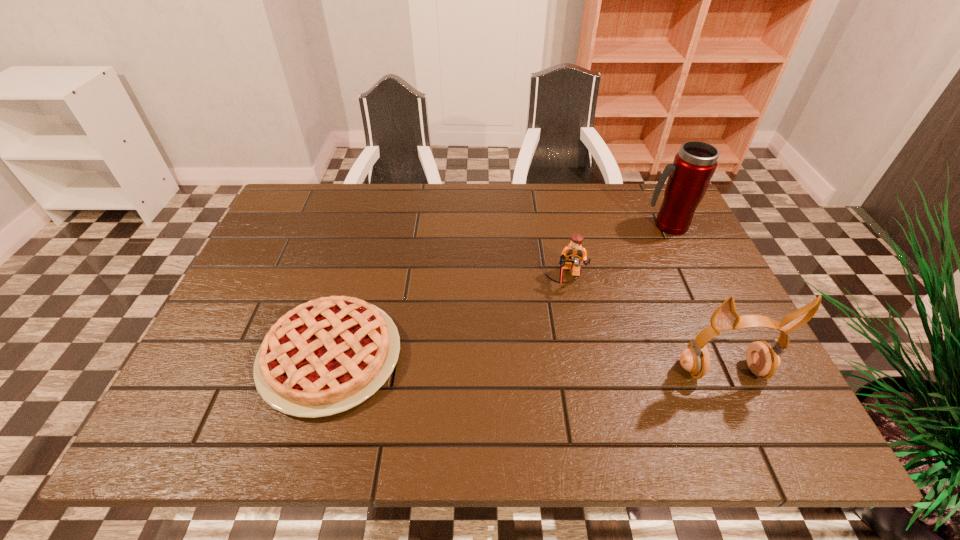
The height and width of the screenshot is (540, 960). I want to click on pie, so click(x=328, y=355).

Locate an element on the screen. The height and width of the screenshot is (540, 960). the leftmost object is located at coordinates (328, 355).

Identify the location of earphone. The height and width of the screenshot is (540, 960). (762, 359).

Where is `Lego`? Lego is located at coordinates (572, 255).

Locate an element on the screen. This screenshot has width=960, height=540. the third tallest object is located at coordinates (572, 255).

Find the location of `thermos bottle`. thermos bottle is located at coordinates (689, 176).

Where is `vacant space located on the right of the leftmost object`? Image resolution: width=960 pixels, height=540 pixels. vacant space located on the right of the leftmost object is located at coordinates (443, 356).

At what (x,y) coordinates should I click in order to perform the action: click on blank space located holding a crossbow in the hands of the Lego. Please return your answer as a coordinate pair (x, y). Looking at the image, I should click on pos(565,331).

The width and height of the screenshot is (960, 540). Find the location of `free space located 0.120m holding a crossbow in the hands of the Lego`. free space located 0.120m holding a crossbow in the hands of the Lego is located at coordinates (565, 331).

In order to click on free space located 0.100m holding a crossbow in the hands of the Lego in this screenshot , I will do `click(565, 324)`.